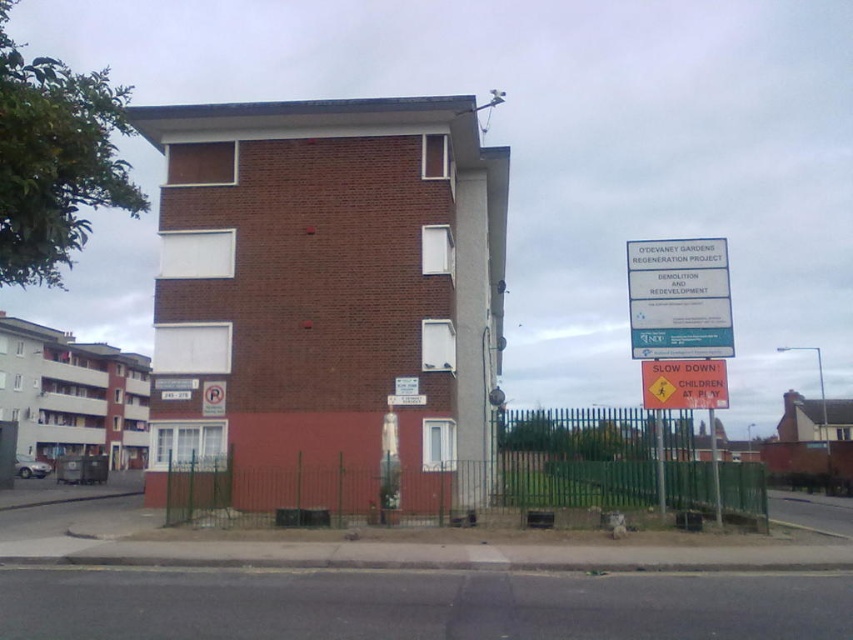
Question: Is green metal fence at center thinner than orange plastic sign at right?

Choices:
 (A) no
 (B) yes

Answer: (A)

Question: Is green metal fence at center further to camera compared to orange plastic sign at right?

Choices:
 (A) no
 (B) yes

Answer: (A)

Question: Which point is closer to the camera taking this photo?

Choices:
 (A) (660, 404)
 (B) (525, 506)

Answer: (A)

Question: Is green metal fence at center bigger than orange plastic sign at right?

Choices:
 (A) yes
 (B) no

Answer: (A)